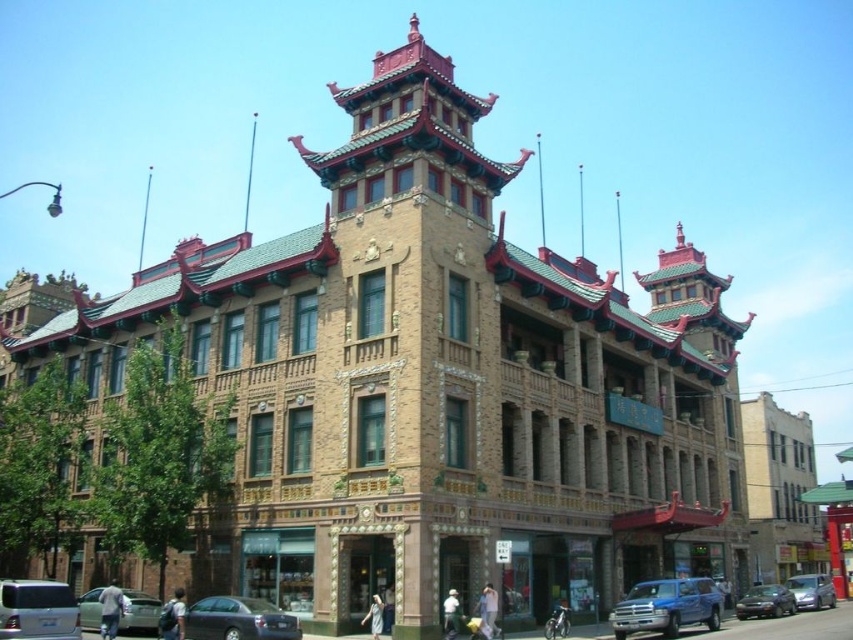
Consider the image. You are a pedestrian standing at the entrance of the building. You need to cross the road to reach the park on the other side. There are two cars parked nearby, a metallic silver car at lower left and a metallic blue car at lower right. If the road is 45 meters wide, can you safely cross between these two cars without needing to walk further?

The distance between the metallic silver car at lower left and the metallic blue car at lower right is 42.79 meters. Since the road is 45 meters wide, the gap between the two cars is not wide enough to safely cross the entire road. You would need to walk further to find a larger gap or use a designated crosswalk.

You are standing on the sidewalk in front of the building and want to take a photo of the brown textured building at center. To avoid including the silver metallic van at lower left in your shot, which direction should you move relative to the van?

Move to the right side of the silver metallic van at lower left to capture the brown textured building at center without including the van in the frame, as the building is positioned to the right of the van.

You are standing in front of the building and want to take a photo. You notice two points marked on the building facade. The first point is at coordinate point (399, 401) and the second is at point (67, 604). Which point is closer to you?

Point (67, 604) is closer to you because it is less further to the camera than point (399, 401).